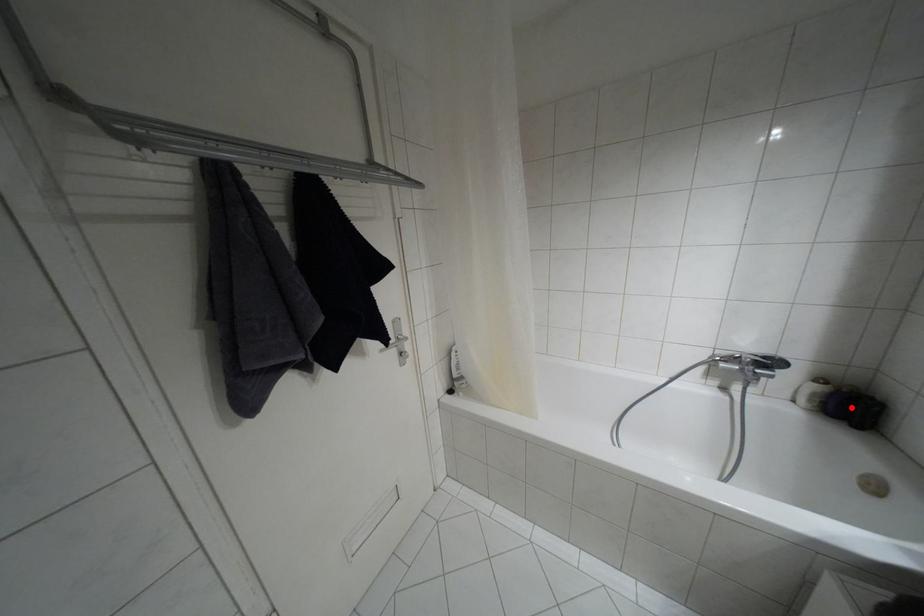
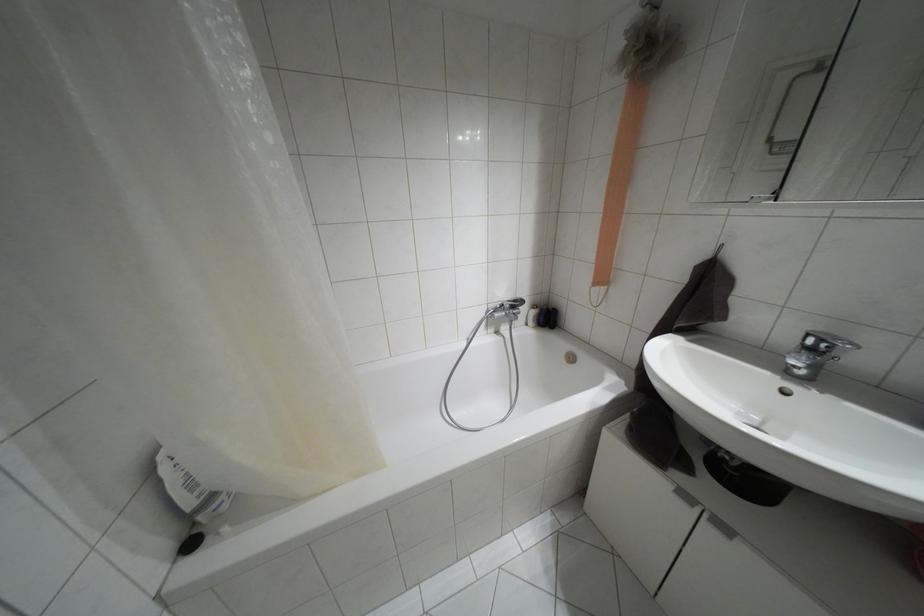
The point at the highlighted location is marked in the first image. Where is the corresponding point in the second image?

(546, 317)